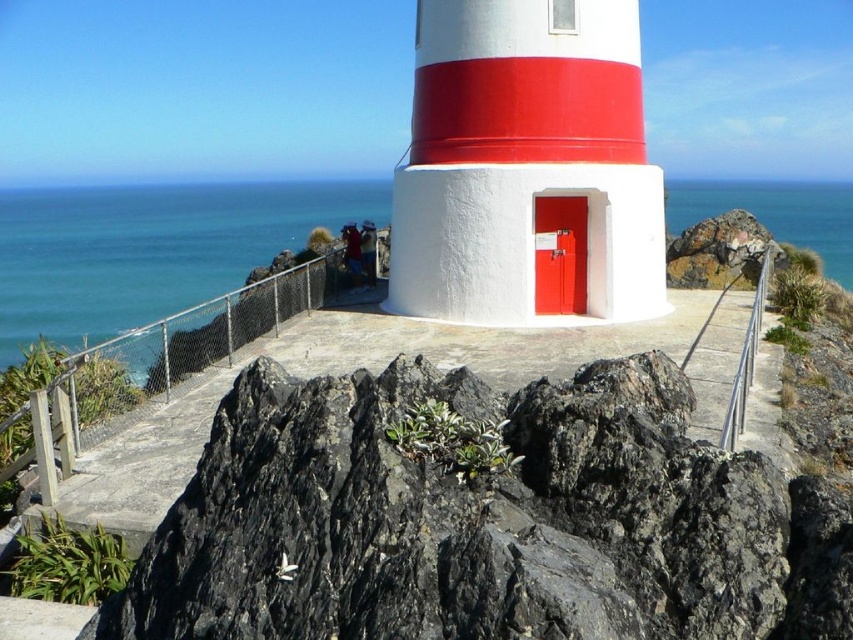
You are standing on the platform near the lighthouse and notice the black rock at center and the blue water at upper center. Which object is taller from your viewpoint?

The blue water at upper center is taller than the black rock at center.

You are standing on the platform near the lighthouse and want to take a photo of the black rock at center and the blue water at upper center. Which object will appear closer to the camera in the photo?

The black rock at center will appear closer to the camera in the photo because it is positioned in front of the blue water at upper center.